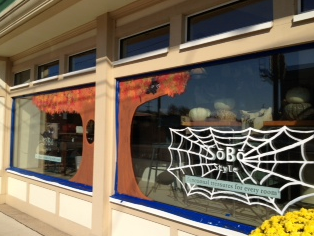
Find the location of `windows`. windows is located at coordinates (24, 74), (52, 68), (82, 61), (146, 44), (232, 17).